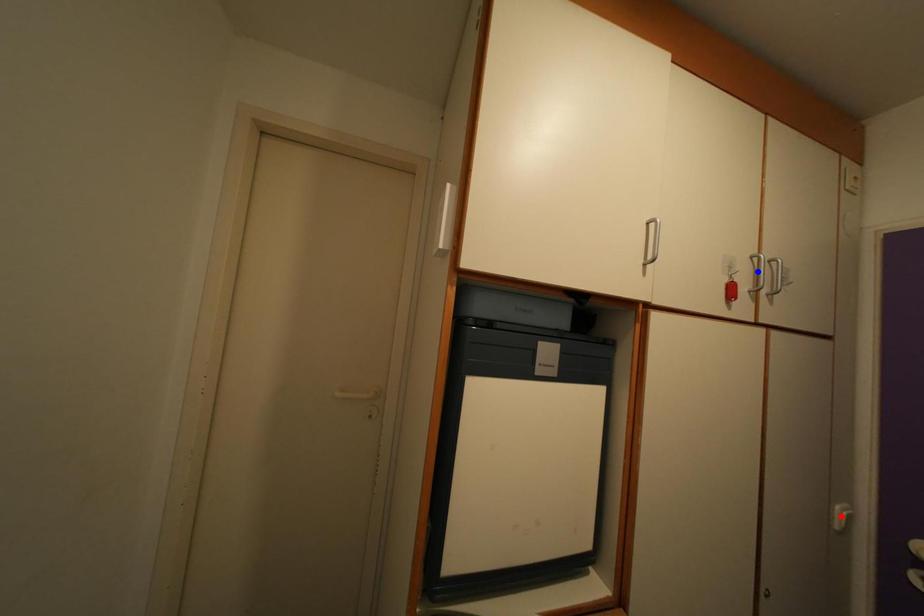
Question: In the image, two points are highlighted. Which point is nearer to the camera? Reply with the corresponding letter.

Choices:
 (A) blue point
 (B) red point

Answer: (B)